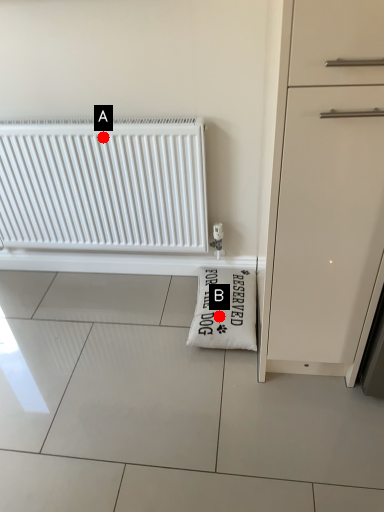
Question: Two points are circled on the image, labeled by A and B beside each circle. Which point is further to the camera?

Choices:
 (A) A is further
 (B) B is further

Answer: (B)